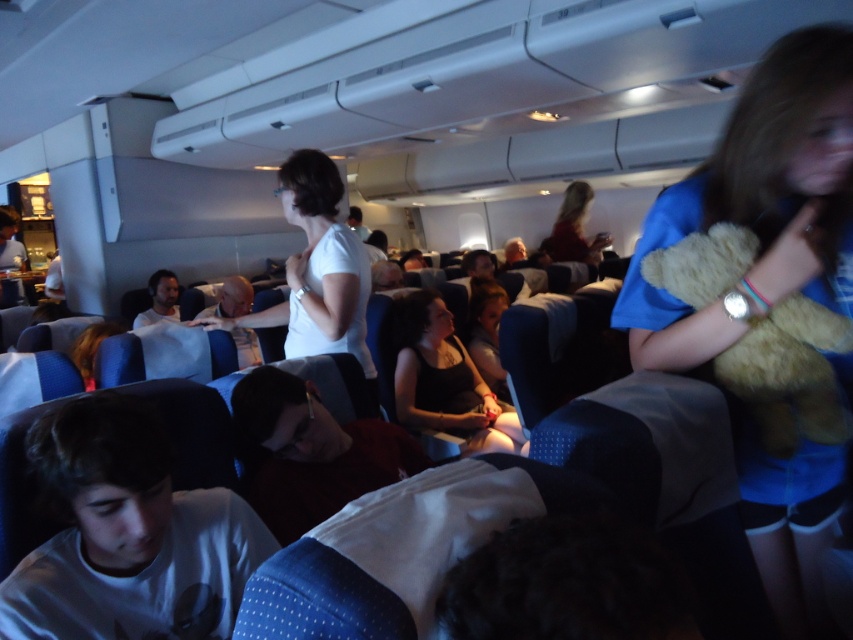
Who is shorter, fluffy beige teddy bear at right or fuzzy beige teddy bear at right?

fuzzy beige teddy bear at right is shorter.

Is fluffy beige teddy bear at right thinner than fuzzy beige teddy bear at right?

No.

Identify the location of fluffy beige teddy bear at right. (759, 204).